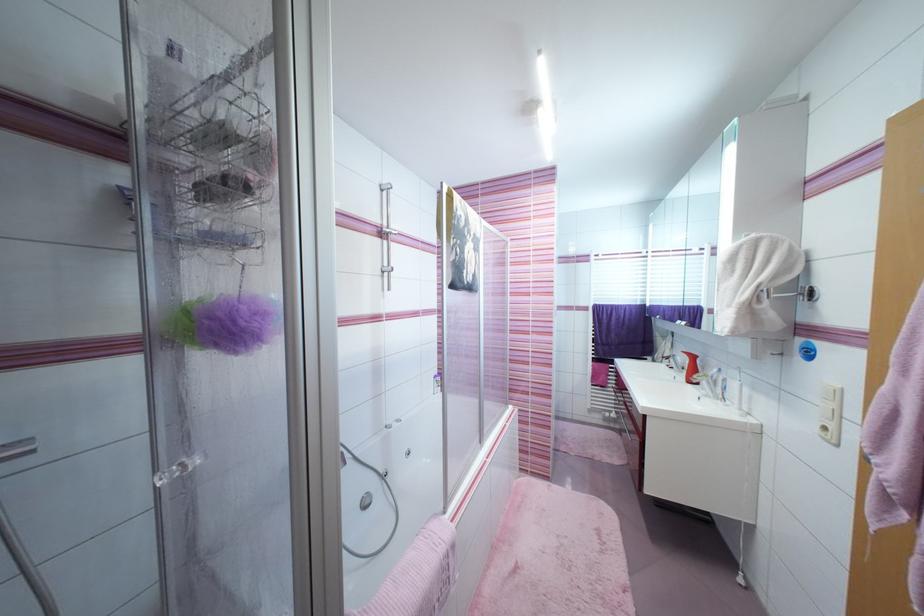
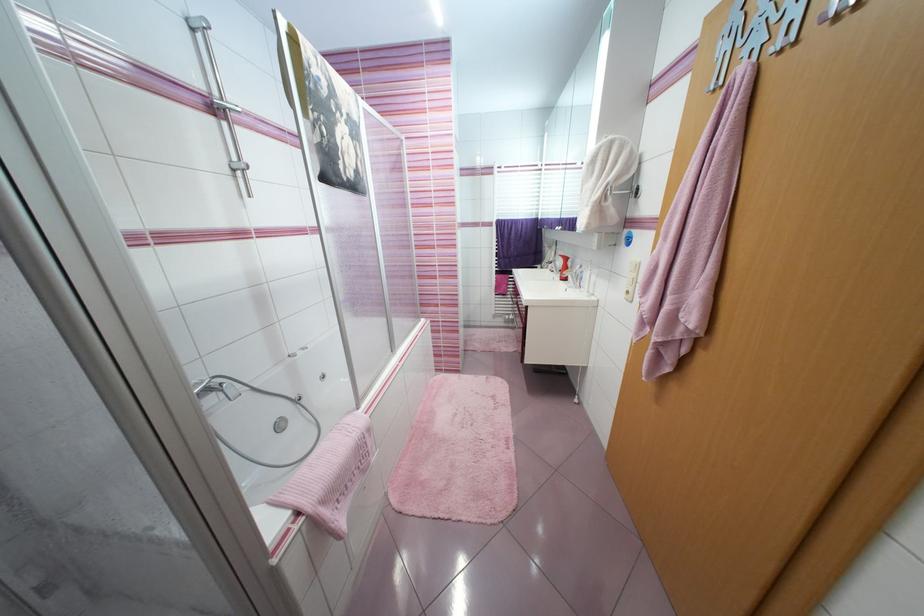
Find the pixel in the second image that matches (x=684, y=360) in the first image.

(563, 264)